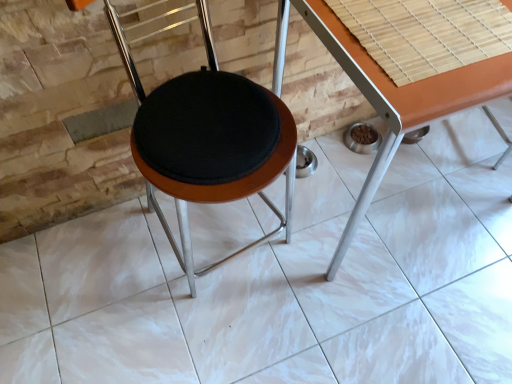
Locate an element on the screen. This screenshot has height=384, width=512. bamboo mat at upper right is located at coordinates (426, 33).

What do you see at coordinates (399, 99) in the screenshot? This screenshot has height=384, width=512. I see `orange laminate table at center` at bounding box center [399, 99].

Identify the location of black fabric cushion at center. (208, 140).

Is bamboo mat at upper right oriented towards orange laminate table at center?

Yes, bamboo mat at upper right is facing orange laminate table at center.

Does bamboo mat at upper right come behind orange laminate table at center?

Yes, it is behind orange laminate table at center.

Can you confirm if bamboo mat at upper right is wider than orange laminate table at center?

No, bamboo mat at upper right is not wider than orange laminate table at center.

How much distance is there between bamboo mat at upper right and orange laminate table at center?

bamboo mat at upper right is 2.14 inches from orange laminate table at center.

The height and width of the screenshot is (384, 512). I want to click on chair that is below the bamboo mat at upper right (from the image's perspective), so click(208, 140).

Who is taller, bamboo mat at upper right or black fabric cushion at center?

black fabric cushion at center.

Considering the sizes of objects bamboo mat at upper right and black fabric cushion at center in the image provided, who is smaller, bamboo mat at upper right or black fabric cushion at center?

bamboo mat at upper right is smaller.

Based on the photo, how different are the orientations of bamboo mat at upper right and black fabric cushion at center in degrees?

There is a 82.9-degree angle between the facing directions of bamboo mat at upper right and black fabric cushion at center.

From the image's perspective, which one is positioned lower, orange laminate table at center or bamboo mat at upper right?

orange laminate table at center is shown below in the image.

The image size is (512, 384). What are the coordinates of `table below the bamboo mat at upper right (from a real-world perspective)` in the screenshot? It's located at (399, 99).

Considering the points (332, 35) and (505, 14), which point is behind, point (332, 35) or point (505, 14)?

The point (505, 14) is behind.

Can you confirm if orange laminate table at center is smaller than bamboo mat at upper right?

No, orange laminate table at center is not smaller than bamboo mat at upper right.

Which object is closer to the camera taking this photo, black fabric cushion at center or orange laminate table at center?

black fabric cushion at center is in front.

Is black fabric cushion at center bigger than orange laminate table at center?

No, black fabric cushion at center is not bigger than orange laminate table at center.

Does black fabric cushion at center have a lesser height compared to orange laminate table at center?

Incorrect, the height of black fabric cushion at center does not fall short of that of orange laminate table at center.

At what (x,y) coordinates should I click in order to perform the action: click on table above the black fabric cushion at center (from the image's perspective). Please return your answer as a coordinate pair (x, y). Looking at the image, I should click on (399, 99).

From the image's perspective, would you say black fabric cushion at center is shown under bamboo mat at upper right?

Yes, from the image's perspective, black fabric cushion at center is beneath bamboo mat at upper right.

Considering the sizes of objects black fabric cushion at center and bamboo mat at upper right in the image provided, who is shorter, black fabric cushion at center or bamboo mat at upper right?

Standing shorter between the two is bamboo mat at upper right.

Is bamboo mat at upper right at the back of black fabric cushion at center?

No.

From the image's perspective, is orange laminate table at center over black fabric cushion at center?

Yes, from the image's perspective, orange laminate table at center is above black fabric cushion at center.

Is point (278, 60) in front of point (207, 156)?

No, (278, 60) is further to viewer.

Considering the sizes of objects orange laminate table at center and black fabric cushion at center in the image provided, who is thinner, orange laminate table at center or black fabric cushion at center?

Thinner between the two is black fabric cushion at center.

Are orange laminate table at center and black fabric cushion at center far apart?

→ No, orange laminate table at center is not far away from black fabric cushion at center.

You are a GUI agent. You are given a task and a screenshot of the screen. Output one action in this format:
    pyautogui.click(x=<x>, y=<y>)
    Task: Click on the table top behind the orange laminate table at center
    The image size is (512, 384).
    Given the screenshot: What is the action you would take?
    pyautogui.click(x=426, y=33)

Find the location of a particular element. table top above the black fabric cushion at center (from the image's perspective) is located at coordinates (426, 33).

Estimate the real-world distances between objects in this image. Which object is further from orange laminate table at center, bamboo mat at upper right or black fabric cushion at center?

black fabric cushion at center is further to orange laminate table at center.

From the image, which object appears to be nearer to bamboo mat at upper right, orange laminate table at center or black fabric cushion at center?

Among the two, orange laminate table at center is located nearer to bamboo mat at upper right.

Estimate the real-world distances between objects in this image. Which object is closer to black fabric cushion at center, orange laminate table at center or bamboo mat at upper right?

Among the two, orange laminate table at center is located nearer to black fabric cushion at center.

From the picture: Which object lies nearer to the anchor point orange laminate table at center, black fabric cushion at center or bamboo mat at upper right?

bamboo mat at upper right is closer to orange laminate table at center.

Looking at the image, which one is located further to black fabric cushion at center, bamboo mat at upper right or orange laminate table at center?

bamboo mat at upper right is further to black fabric cushion at center.

Looking at the image, which one is located closer to bamboo mat at upper right, black fabric cushion at center or orange laminate table at center?

orange laminate table at center lies closer to bamboo mat at upper right than the other object.

Where is `table top between black fabric cushion at center and orange laminate table at center from left to right`? table top between black fabric cushion at center and orange laminate table at center from left to right is located at coordinates (426, 33).